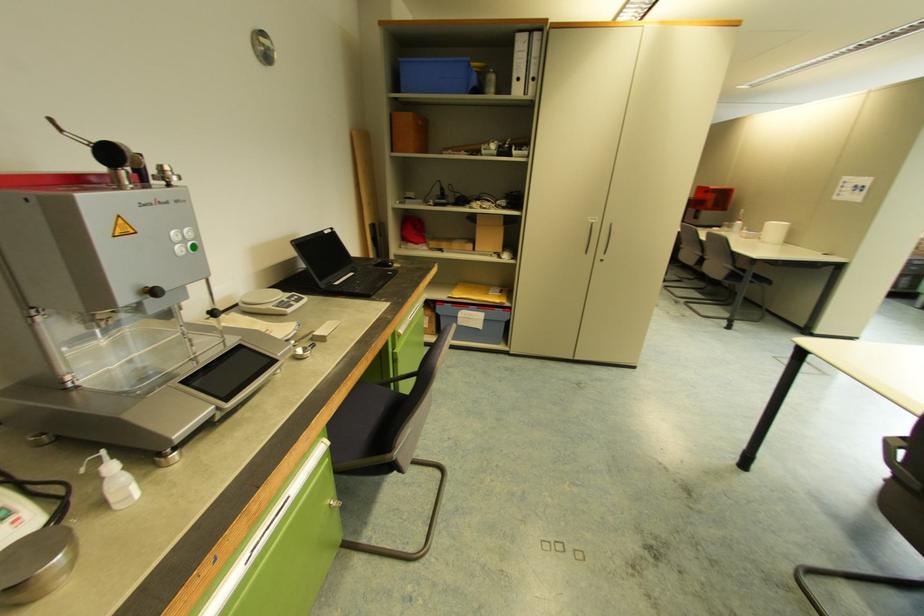
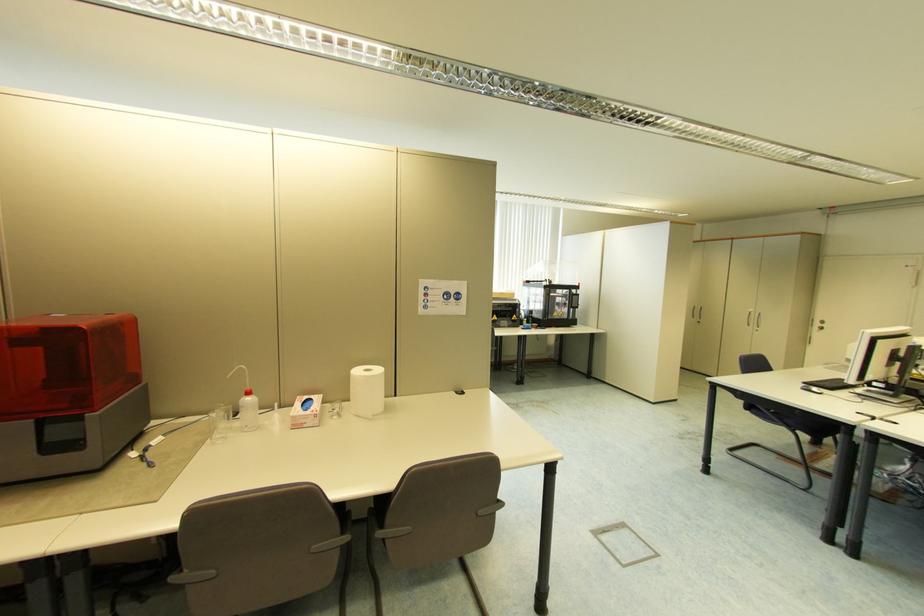
In the second image, find the point that corresponds to point 743,221 in the first image.

(252, 392)